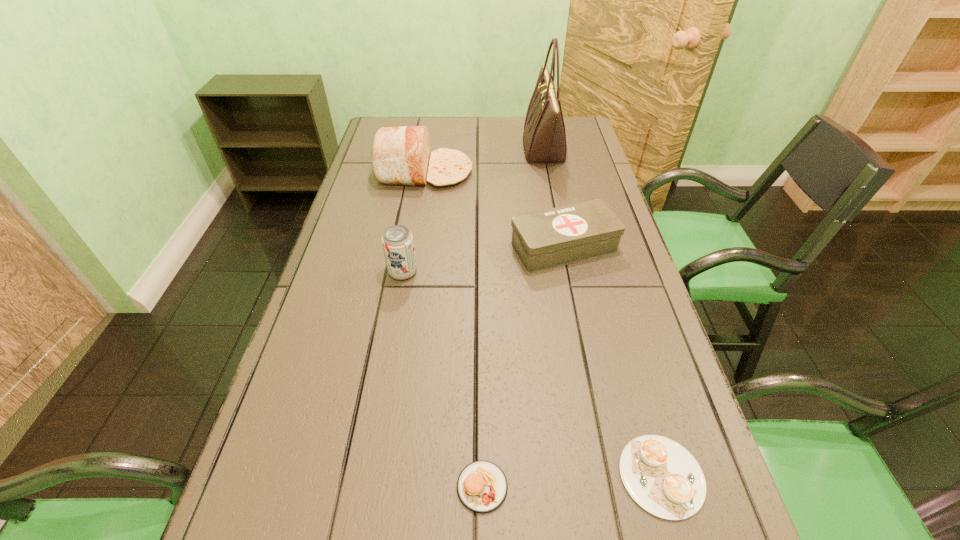
You are a GUI agent. You are given a task and a screenshot of the screen. Output one action in this format:
    pyautogui.click(x=<x>, y=<y>)
    Task: Click on the vacant space that is in between the tallest object and the beer can
    Image resolution: width=960 pixels, height=540 pixels.
    Given the screenshot: What is the action you would take?
    point(473,211)

Find the location of `free space that is in between the cappuccino and the third shortest object`. free space that is in between the cappuccino and the third shortest object is located at coordinates (612, 361).

Where is `free space between the bread and the patty`? Image resolution: width=960 pixels, height=540 pixels. free space between the bread and the patty is located at coordinates (453, 329).

Where is `unoccupied area between the shortest object and the fifth tallest object`? This screenshot has height=540, width=960. unoccupied area between the shortest object and the fifth tallest object is located at coordinates coord(572,481).

Identify which object is the fifth nearest to the beer can. Please provide its 2D coordinates. Your answer should be formatted as a tuple, i.e. [(x, y)], where the tuple contains the x and y coordinates of a point satisfying the conditions above.

[(662, 477)]

Where is `object that is the third closest to the beer can`? The image size is (960, 540). object that is the third closest to the beer can is located at coordinates (482, 486).

Locate an element on the screen. The height and width of the screenshot is (540, 960). blank area in the image that satisfies the following two spatial constraints: 1. at the sliced end of the cappuccino; 2. on the right side of the bread is located at coordinates (374, 476).

You are a GUI agent. You are given a task and a screenshot of the screen. Output one action in this format:
    pyautogui.click(x=<x>, y=<y>)
    Task: Click on the free space that satisfies the following two spatial constraints: 1. at the sliced end of the third shortest object; 2. on the left side of the bread
    The image size is (960, 540).
    Given the screenshot: What is the action you would take?
    pyautogui.click(x=412, y=247)

Where is `free location that satisfies the following two spatial constraints: 1. at the sliced end of the bread; 2. on the front side of the beer can`? The height and width of the screenshot is (540, 960). free location that satisfies the following two spatial constraints: 1. at the sliced end of the bread; 2. on the front side of the beer can is located at coordinates (408, 273).

The image size is (960, 540). I want to click on vacant space that satisfies the following two spatial constraints: 1. at the sliced end of the cappuccino; 2. on the left side of the bread, so click(x=374, y=476).